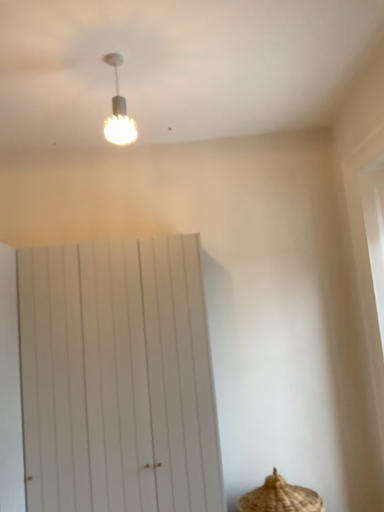
Question: Is the depth of white wooden barn door at center less than that of brown woven basket at lower right?

Choices:
 (A) yes
 (B) no

Answer: (B)

Question: Considering the relative positions of white wooden barn door at center and brown woven basket at lower right in the image provided, is white wooden barn door at center to the right of brown woven basket at lower right from the viewer's perspective?

Choices:
 (A) yes
 (B) no

Answer: (B)

Question: Is white wooden barn door at center oriented towards brown woven basket at lower right?

Choices:
 (A) yes
 (B) no

Answer: (B)

Question: From the image's perspective, is white wooden barn door at center beneath brown woven basket at lower right?

Choices:
 (A) no
 (B) yes

Answer: (A)

Question: From the image's perspective, is white wooden barn door at center on brown woven basket at lower right?

Choices:
 (A) no
 (B) yes

Answer: (B)

Question: From a real-world perspective, does white wooden barn door at center sit lower than brown woven basket at lower right?

Choices:
 (A) yes
 (B) no

Answer: (B)

Question: Is white wooden barn door at center behind white textured bulb at upper center?

Choices:
 (A) yes
 (B) no

Answer: (A)

Question: Are white wooden barn door at center and white textured bulb at upper center making contact?

Choices:
 (A) no
 (B) yes

Answer: (A)

Question: Is white wooden barn door at center taller than white textured bulb at upper center?

Choices:
 (A) no
 (B) yes

Answer: (B)

Question: Is white wooden barn door at center at the right side of white textured bulb at upper center?

Choices:
 (A) yes
 (B) no

Answer: (B)

Question: Can you confirm if white wooden barn door at center is thinner than white textured bulb at upper center?

Choices:
 (A) no
 (B) yes

Answer: (A)

Question: Is white wooden barn door at center bigger than white textured bulb at upper center?

Choices:
 (A) yes
 (B) no

Answer: (A)

Question: From the image's perspective, is white textured bulb at upper center under white wooden barn door at center?

Choices:
 (A) no
 (B) yes

Answer: (A)